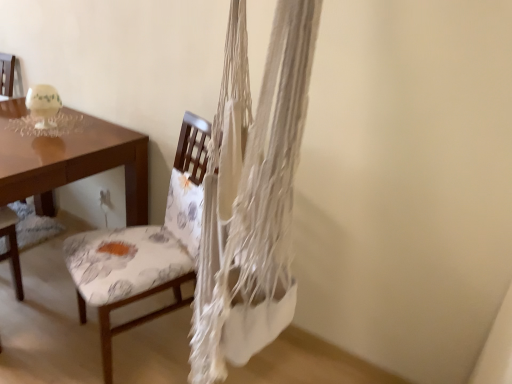
Locate an element on the screen. floral fabric chair at left is located at coordinates (136, 318).

Image resolution: width=512 pixels, height=384 pixels. What do you see at coordinates (136, 318) in the screenshot? I see `floral fabric chair at left` at bounding box center [136, 318].

The image size is (512, 384). What do you see at coordinates (71, 160) in the screenshot?
I see `brown glossy desk at left` at bounding box center [71, 160].

This screenshot has height=384, width=512. I want to click on brown glossy desk at left, so click(71, 160).

Image resolution: width=512 pixels, height=384 pixels. What are the coordinates of `floral fabric chair at left` in the screenshot? It's located at (136, 318).

Is brown glossy desk at left at the right side of floral fabric chair at left?

No, brown glossy desk at left is not to the right of floral fabric chair at left.

Looking at this image, is the position of brown glossy desk at left more distant than that of floral fabric chair at left?

Yes, it is behind floral fabric chair at left.

Is point (8, 194) positioned after point (180, 167)?

No, (8, 194) is in front of (180, 167).

From the image's perspective, is brown glossy desk at left located above floral fabric chair at left?

Indeed, from the image's perspective, brown glossy desk at left is shown above floral fabric chair at left.

From a real-world perspective, is brown glossy desk at left on top of floral fabric chair at left?

Actually, brown glossy desk at left is physically below floral fabric chair at left in the real world.

Between brown glossy desk at left and floral fabric chair at left, which one has larger width?

Wider between the two is brown glossy desk at left.

Is brown glossy desk at left taller or shorter than floral fabric chair at left?

In the image, brown glossy desk at left appears to be shorter than floral fabric chair at left.

Can you confirm if brown glossy desk at left is smaller than floral fabric chair at left?

Incorrect, brown glossy desk at left is not smaller in size than floral fabric chair at left.

Can floral fabric chair at left be found inside brown glossy desk at left?

No, floral fabric chair at left is not surrounded by brown glossy desk at left.

Is brown glossy desk at left positioned far away from floral fabric chair at left?

No.

Could you tell me if brown glossy desk at left is facing floral fabric chair at left?

No, brown glossy desk at left is not turned towards floral fabric chair at left.

What's the angular difference between brown glossy desk at left and floral fabric chair at left's facing directions?

brown glossy desk at left and floral fabric chair at left are facing 25.1 degrees away from each other.

Locate an element on the screen. desk located underneath the floral fabric chair at left (from a real-world perspective) is located at coordinates (71, 160).

Is floral fabric chair at left at the left side of brown glossy desk at left?

Incorrect, floral fabric chair at left is not on the left side of brown glossy desk at left.

From the picture: Considering the relative positions of floral fabric chair at left and brown glossy desk at left in the image provided, is floral fabric chair at left in front of brown glossy desk at left?

Yes, floral fabric chair at left is in front of brown glossy desk at left.

Is point (191, 179) positioned behind point (57, 165)?

Yes.

From the image's perspective, which is above, floral fabric chair at left or brown glossy desk at left?

brown glossy desk at left.

From a real-world perspective, between floral fabric chair at left and brown glossy desk at left, who is vertically higher?

From a 3D spatial view, floral fabric chair at left is above.

Which of these two, floral fabric chair at left or brown glossy desk at left, is thinner?

With smaller width is floral fabric chair at left.

Between floral fabric chair at left and brown glossy desk at left, which one has more height?

With more height is floral fabric chair at left.

Which of these two, floral fabric chair at left or brown glossy desk at left, is bigger?

Bigger between the two is brown glossy desk at left.

Is floral fabric chair at left spatially inside brown glossy desk at left, or outside of it?

floral fabric chair at left is located beyond the bounds of brown glossy desk at left.

Is floral fabric chair at left next to brown glossy desk at left?

floral fabric chair at left is not next to brown glossy desk at left, and they're not touching.

Could you tell me if floral fabric chair at left is turned towards brown glossy desk at left?

No, floral fabric chair at left is not turned towards brown glossy desk at left.

This screenshot has width=512, height=384. Find the location of `desk on the left side of floral fabric chair at left`. desk on the left side of floral fabric chair at left is located at coordinates (71, 160).

This screenshot has width=512, height=384. What are the coordinates of `chair below the brown glossy desk at left (from the image's perspective)` in the screenshot? It's located at (136, 318).

The height and width of the screenshot is (384, 512). What are the coordinates of `desk beneath the floral fabric chair at left (from a real-world perspective)` in the screenshot? It's located at (71, 160).